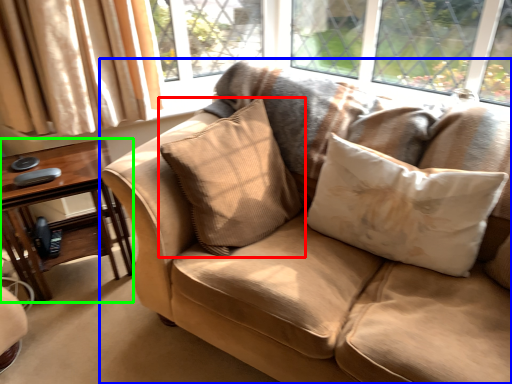
Question: Based on their relative distances, which object is farther from pillow (highlighted by a red box)? Choose from studio couch (highlighted by a blue box) and table (highlighted by a green box).

Choices:
 (A) studio couch
 (B) table

Answer: (B)